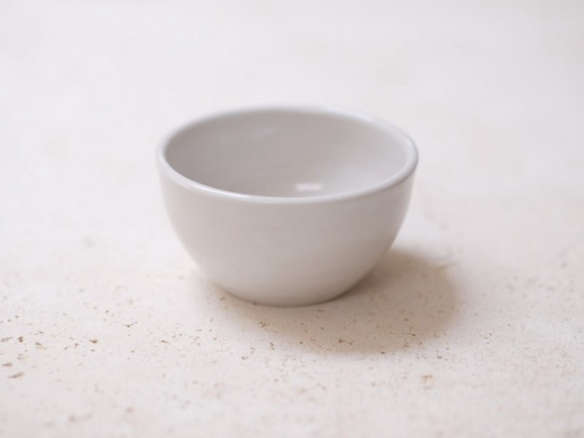
Find the location of a particular element. The height and width of the screenshot is (438, 584). light source is located at coordinates (62, 9).